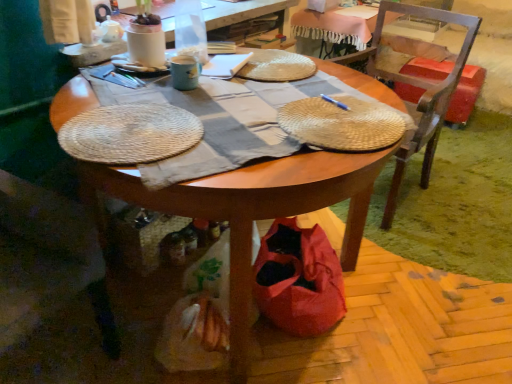
Question: From a real-world perspective, is woven straw placemat at center above or below wooden table at center?

Choices:
 (A) below
 (B) above

Answer: (B)

Question: In terms of height, does woven straw placemat at center look taller or shorter compared to wooden table at center?

Choices:
 (A) short
 (B) tall

Answer: (A)

Question: Which is farther from the blue metallic pen at center?

Choices:
 (A) wooden table at center
 (B) red plastic trash can at right
 (C) woven straw placemat at center
 (D) woven wood chair at lower left, positioned as the 1th chair in left-to-right order
 (E) translucent plastic bottle at upper center

Answer: (B)

Question: Which object is positioned farthest from the wooden table at center?

Choices:
 (A) woven straw placemat at center
 (B) translucent plastic bottle at upper center
 (C) matte ceramic mug at upper center
 (D) blue metallic pen at center
 (E) wooden chair at right, marked as the first chair in a right-to-left arrangement

Answer: (E)